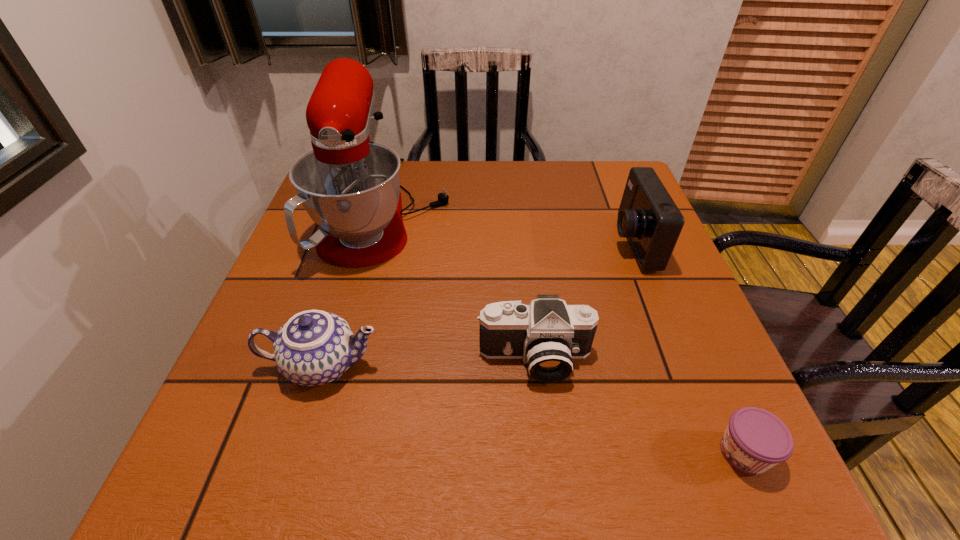
This screenshot has height=540, width=960. I want to click on empty space that is in between the chinaware and the right camera, so click(477, 304).

Image resolution: width=960 pixels, height=540 pixels. I want to click on unoccupied position between the shortest object and the farther camera, so click(x=688, y=348).

Locate an element on the screen. free point between the chinaware and the jam is located at coordinates (533, 409).

The image size is (960, 540). Identify the location of vacant region between the farther camera and the jam. (688, 348).

Where is `vacant area that lies between the third object from left to right and the tallest object`? The width and height of the screenshot is (960, 540). vacant area that lies between the third object from left to right and the tallest object is located at coordinates (462, 285).

Identify the location of free spot between the chinaware and the nearer camera. Image resolution: width=960 pixels, height=540 pixels. (428, 362).

Identify the location of vacant region between the chinaware and the right camera. The height and width of the screenshot is (540, 960). (477, 304).

Find the location of `free space between the chinaware and the right camera`. free space between the chinaware and the right camera is located at coordinates (477, 304).

Image resolution: width=960 pixels, height=540 pixels. Identify the location of object that is the third nearest to the third object from right to left. (755, 440).

Identify the location of object that is the closest to the tallest object. This screenshot has height=540, width=960. (314, 347).